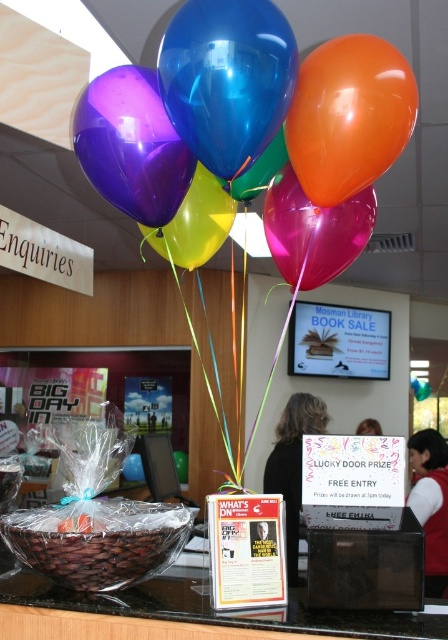
You are organizing a party and want to ensure the orange glossy balloon at upper right and the glossy latex balloons at upper center are visible to all guests. Since the orange balloon is thinner, which one might you need to adjust to ensure visibility?

The orange glossy balloon at upper right is thinner than the glossy latex balloons at upper center, so you might need to adjust its position to ensure it stands out more among the thicker balloons.

You are organizing a party and need to choose between two balloons for a decoration. The orange glossy balloon at upper right and the purple glossy balloon at upper left. Which one is smaller in size?

The orange glossy balloon at upper right has a lesser width compared to the purple glossy balloon at upper left, so it is smaller in size.